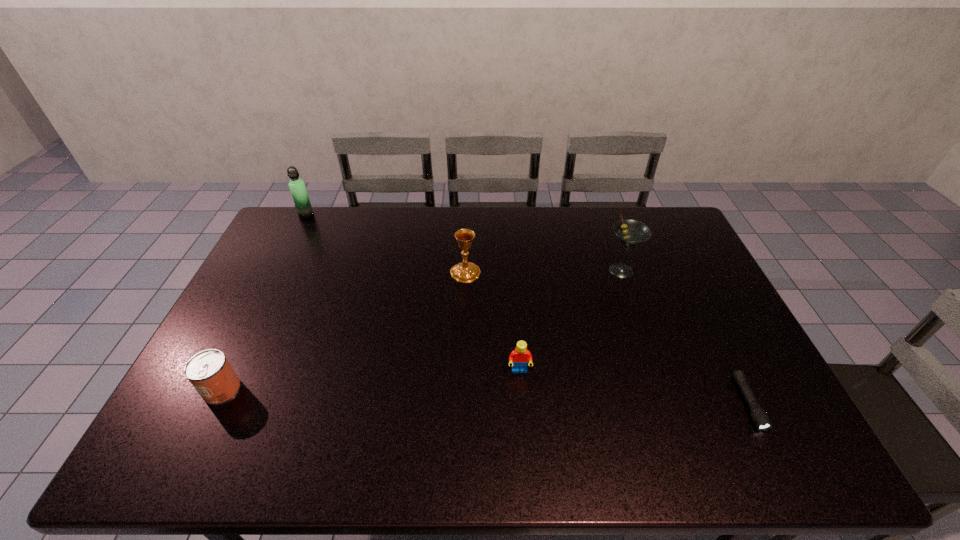
At what (x,y) coordinates should I click in order to perform the action: click on vacant space in between the fourth shortest object and the can. Please return your answer as a coordinate pair (x, y). This screenshot has height=540, width=960. Looking at the image, I should click on (344, 331).

Where is `free spot between the can and the chalice`? free spot between the can and the chalice is located at coordinates (344, 331).

Where is `the closest object to the martini`? The image size is (960, 540). the closest object to the martini is located at coordinates (760, 418).

Find the location of a particular element. The width and height of the screenshot is (960, 540). the second closest object relative to the fourth object from left to right is located at coordinates (631, 233).